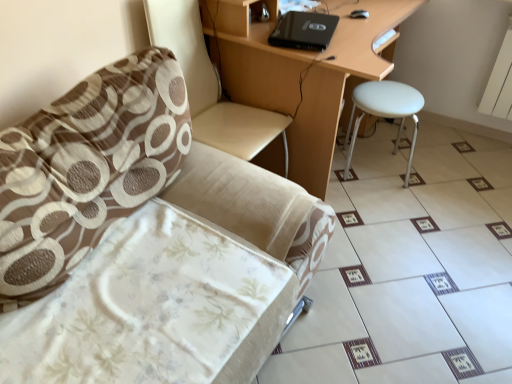
Question: Considering the relative sizes of beige fabric chair at left and white glossy tile at lower right in the image provided, is beige fabric chair at left bigger than white glossy tile at lower right?

Choices:
 (A) yes
 (B) no

Answer: (A)

Question: Does beige fabric chair at left have a smaller size compared to white glossy tile at lower right?

Choices:
 (A) yes
 (B) no

Answer: (B)

Question: Is beige fabric chair at left oriented away from white glossy tile at lower right?

Choices:
 (A) yes
 (B) no

Answer: (B)

Question: Is white glossy tile at lower right inside beige fabric chair at left?

Choices:
 (A) yes
 (B) no

Answer: (B)

Question: Is beige fabric chair at left positioned before white glossy tile at lower right?

Choices:
 (A) yes
 (B) no

Answer: (A)

Question: Considering the positions of beige fabric swivel chair at left and white matte stool at right in the image, is beige fabric swivel chair at left taller or shorter than white matte stool at right?

Choices:
 (A) short
 (B) tall

Answer: (B)

Question: Is beige fabric swivel chair at left in front of or behind white matte stool at right in the image?

Choices:
 (A) front
 (B) behind

Answer: (A)

Question: Is beige fabric swivel chair at left bigger or smaller than white matte stool at right?

Choices:
 (A) small
 (B) big

Answer: (B)

Question: In terms of width, does beige fabric swivel chair at left look wider or thinner when compared to white matte stool at right?

Choices:
 (A) wide
 (B) thin

Answer: (A)

Question: In the image, is black matte laptop at upper center positioned in front of or behind white matte stool at right?

Choices:
 (A) front
 (B) behind

Answer: (A)

Question: Considering the positions of black matte laptop at upper center and white matte stool at right in the image, is black matte laptop at upper center bigger or smaller than white matte stool at right?

Choices:
 (A) small
 (B) big

Answer: (A)

Question: Which is correct: black matte laptop at upper center is inside white matte stool at right, or outside of it?

Choices:
 (A) inside
 (B) outside

Answer: (B)

Question: In terms of height, does black matte laptop at upper center look taller or shorter compared to white matte stool at right?

Choices:
 (A) short
 (B) tall

Answer: (A)

Question: In terms of size, does white glossy tile at lower right appear bigger or smaller than brown textured pillow at left?

Choices:
 (A) small
 (B) big

Answer: (B)

Question: In terms of height, does white glossy tile at lower right look taller or shorter compared to brown textured pillow at left?

Choices:
 (A) tall
 (B) short

Answer: (B)